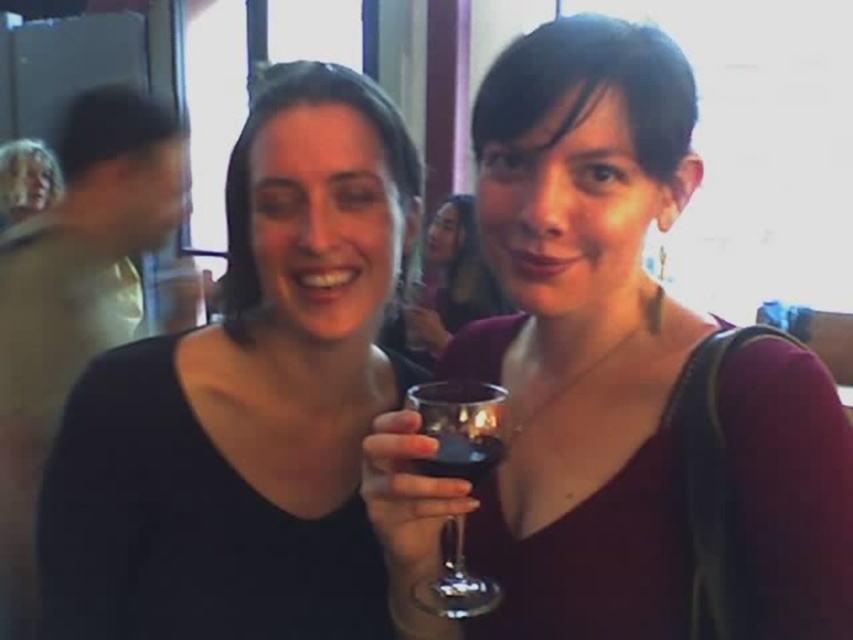
You are a photographer at a party and want to take a photo of the matte black dress at center without the blonde hair at upper left appearing in the background. Is this possible based on their positions?

The matte black dress at center is in front of the blonde hair at upper left, so yes, you can take a photo of the matte black dress at center without the blonde hair at upper left showing in the background because it is positioned behind.

You are standing in the same room as the two people in the image. You want to walk from the point at coordinates point (123, 529) to the point at coordinates point (448, 468). Will you have to move forward or backward to get closer to the second point?

Since point (123, 529) is behind point (448, 468), you will have to move forward to get closer to the second point.